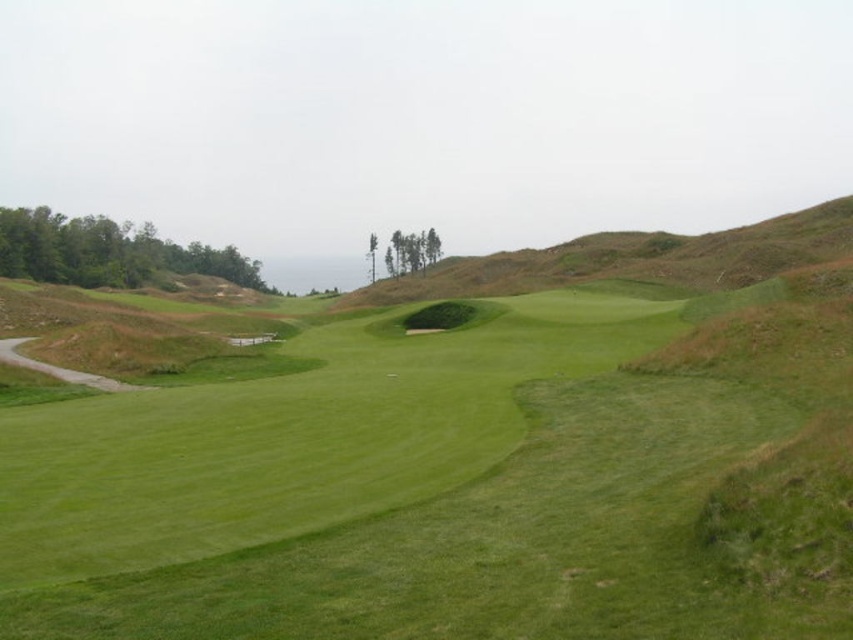
Is green grassy golf course at center below brown earthy hillside at center?

Yes, green grassy golf course at center is below brown earthy hillside at center.

Who is more forward, (231, 605) or (490, 257)?

Point (231, 605) is more forward.

Locate an element on the screen. The height and width of the screenshot is (640, 853). green grassy golf course at center is located at coordinates (397, 493).